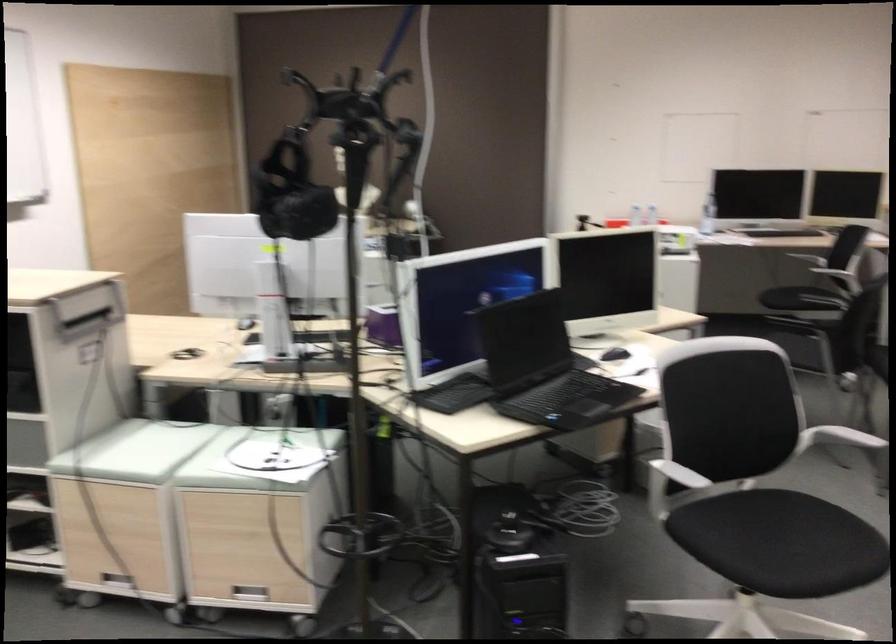
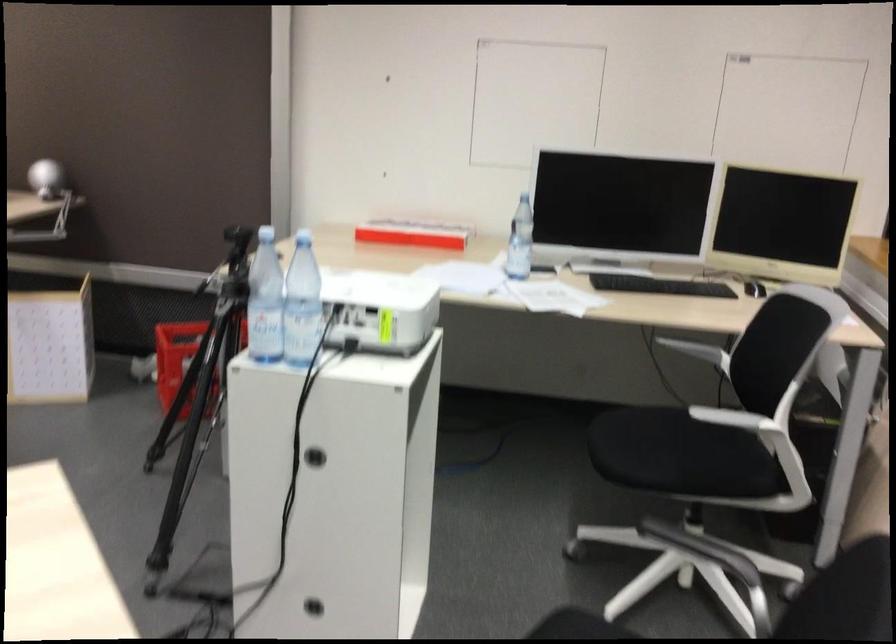
Which direction would the cameraman need to move to produce the second image?

The movement direction of the cameraman is right, forward.